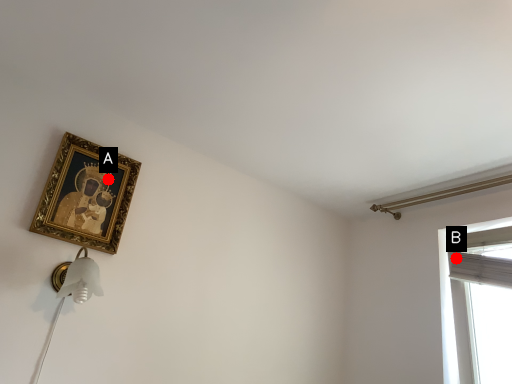
Question: Two points are circled on the image, labeled by A and B beside each circle. Which of the following is the farthest from the observer?

Choices:
 (A) A is further
 (B) B is further

Answer: (B)